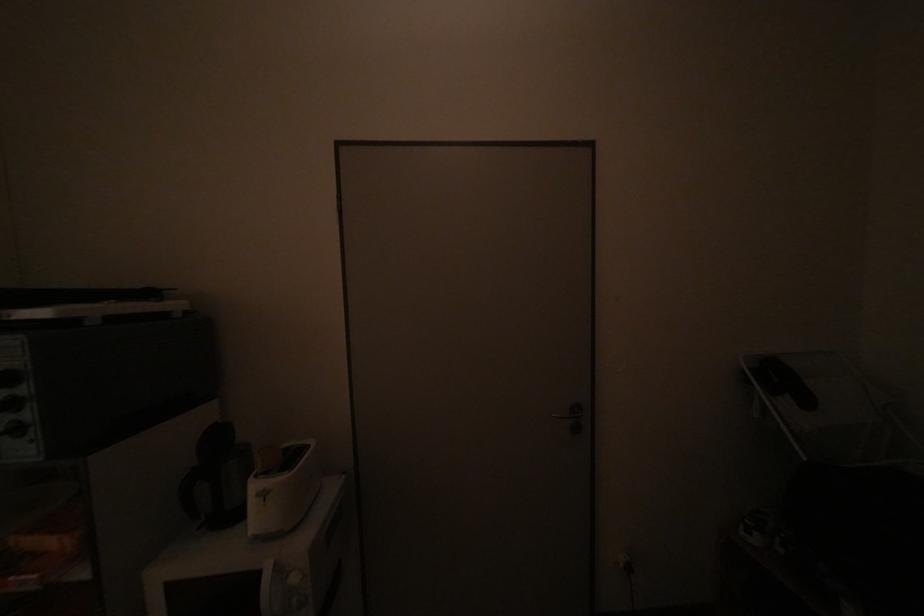
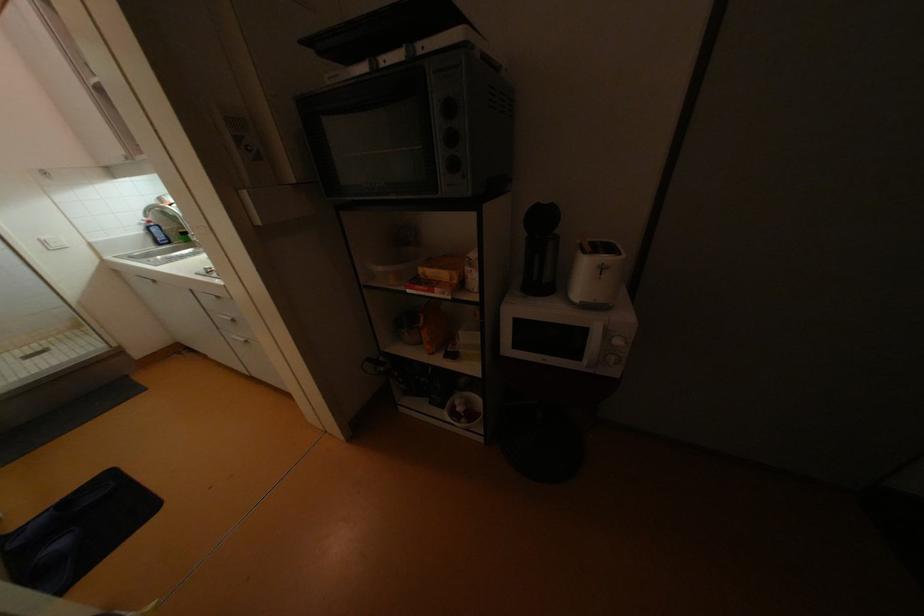
Locate, in the second image, the point that corresponds to (x=55, y=544) in the first image.

(450, 276)